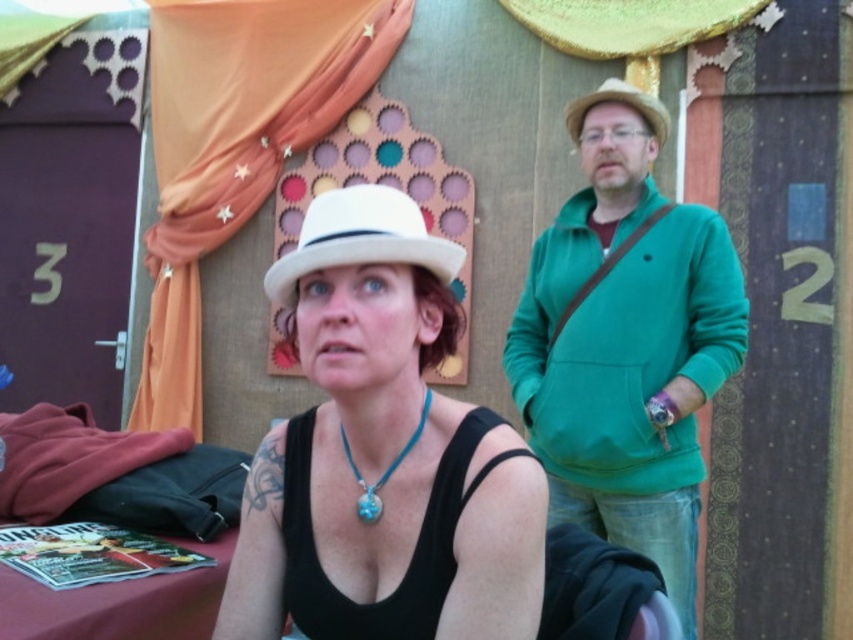
Question: Does matte white hat at center come in front of turquoise stone pendant at center?

Choices:
 (A) no
 (B) yes

Answer: (B)

Question: From the image, what is the correct spatial relationship of black matte tank top at center in relation to light brown felt cowboy hat at upper right?

Choices:
 (A) above
 (B) below

Answer: (B)

Question: Does green matte sweater at right have a greater width compared to turquoise stone pendant at center?

Choices:
 (A) no
 (B) yes

Answer: (B)

Question: Which point is farther to the camera?

Choices:
 (A) pyautogui.click(x=485, y=547)
 (B) pyautogui.click(x=374, y=502)
 (C) pyautogui.click(x=575, y=125)

Answer: (C)

Question: Which of these objects is positioned closest to the light brown felt cowboy hat at upper right?

Choices:
 (A) green matte sweater at right
 (B) matte white hat at center

Answer: (A)

Question: Which object is positioned farthest from the light brown felt cowboy hat at upper right?

Choices:
 (A) white felt cowboy hat at center
 (B) green matte sweater at right

Answer: (A)